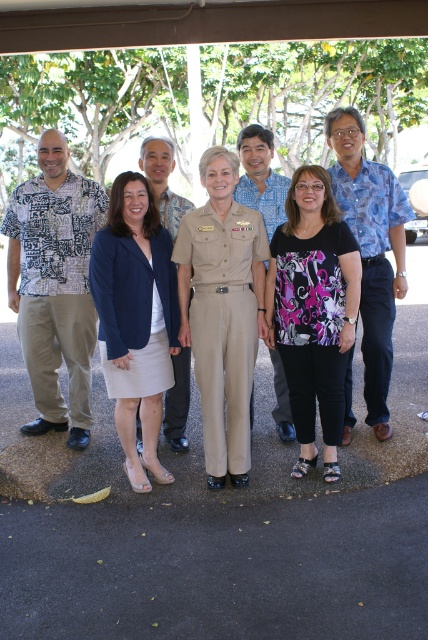
Which is more to the left, printed cotton shirt at left or khaki uniform at center?

printed cotton shirt at left is more to the left.

Can you confirm if printed cotton shirt at left is positioned to the left of khaki uniform at center?

Yes, printed cotton shirt at left is to the left of khaki uniform at center.

Who is more forward, (62, 246) or (223, 429)?

Point (223, 429)

Locate an element on the screen. This screenshot has height=640, width=428. printed cotton shirt at left is located at coordinates (55, 284).

Does printed cotton shirt at left have a larger size compared to blue printed shirt at right?

Incorrect, printed cotton shirt at left is not larger than blue printed shirt at right.

What are the coordinates of `printed cotton shirt at left` in the screenshot? It's located at (55, 284).

Does khaki uniform at center have a smaller size compared to blue printed shirt at right?

Yes, khaki uniform at center is smaller than blue printed shirt at right.

Is the position of khaki uniform at center more distant than that of blue printed shirt at right?

No, khaki uniform at center is in front of blue printed shirt at right.

Is point (223, 276) less distant than point (379, 195)?

Yes, it is in front of point (379, 195).

The image size is (428, 640). I want to click on khaki uniform at center, so click(222, 312).